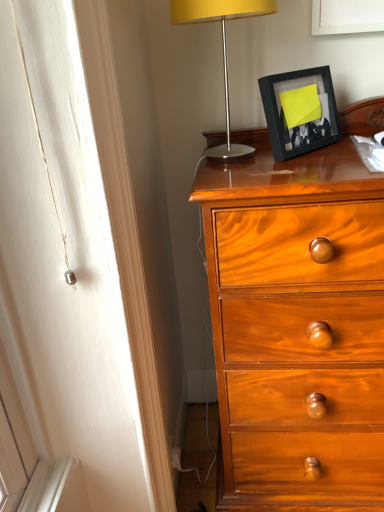
Question: Should I look upward or downward to see black matte picture frame at upper right?

Choices:
 (A) up
 (B) down

Answer: (A)

Question: Is black matte picture frame at upper right shorter than metallic silver lamp at upper right?

Choices:
 (A) yes
 (B) no

Answer: (A)

Question: Is black matte picture frame at upper right further to the viewer compared to metallic silver lamp at upper right?

Choices:
 (A) no
 (B) yes

Answer: (B)

Question: Can you confirm if black matte picture frame at upper right is positioned to the right of metallic silver lamp at upper right?

Choices:
 (A) yes
 (B) no

Answer: (A)

Question: Could you tell me if black matte picture frame at upper right is turned towards metallic silver lamp at upper right?

Choices:
 (A) no
 (B) yes

Answer: (A)

Question: From the image's perspective, is black matte picture frame at upper right beneath metallic silver lamp at upper right?

Choices:
 (A) yes
 (B) no

Answer: (A)

Question: Is black matte picture frame at upper right next to metallic silver lamp at upper right?

Choices:
 (A) no
 (B) yes

Answer: (A)

Question: From a real-world perspective, is metallic silver lamp at upper right physically above black matte picture frame at upper right?

Choices:
 (A) no
 (B) yes

Answer: (B)

Question: Does metallic silver lamp at upper right appear on the right side of black matte picture frame at upper right?

Choices:
 (A) no
 (B) yes

Answer: (A)

Question: Is metallic silver lamp at upper right thinner than black matte picture frame at upper right?

Choices:
 (A) yes
 (B) no

Answer: (B)

Question: Is metallic silver lamp at upper right beside black matte picture frame at upper right?

Choices:
 (A) no
 (B) yes

Answer: (A)

Question: Can you confirm if metallic silver lamp at upper right is bigger than black matte picture frame at upper right?

Choices:
 (A) yes
 (B) no

Answer: (A)

Question: Does metallic silver lamp at upper right lie behind black matte picture frame at upper right?

Choices:
 (A) yes
 (B) no

Answer: (B)

Question: In the image, is metallic silver lamp at upper right positioned in front of or behind black matte picture frame at upper right?

Choices:
 (A) behind
 (B) front

Answer: (B)